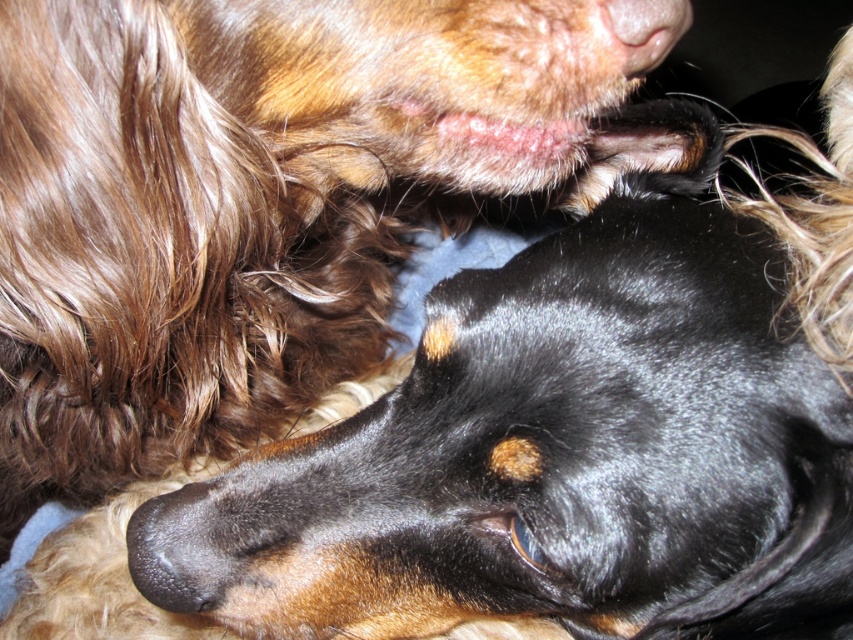
Question: Where is black shiny dog at center located in relation to pink soft skin at upper center in the image?

Choices:
 (A) left
 (B) right

Answer: (A)

Question: Among these objects, which one is farthest from the camera?

Choices:
 (A) black shiny dog at center
 (B) pink soft skin at upper center

Answer: (B)

Question: Considering the relative positions of black shiny dog at center and pink soft skin at upper center in the image provided, where is black shiny dog at center located with respect to pink soft skin at upper center?

Choices:
 (A) left
 (B) right

Answer: (A)

Question: Considering the relative positions of black shiny dog at center and pink soft skin at upper center in the image provided, where is black shiny dog at center located with respect to pink soft skin at upper center?

Choices:
 (A) right
 (B) left

Answer: (B)

Question: Which point is farther to the camera?

Choices:
 (A) (666, 44)
 (B) (238, 54)

Answer: (B)